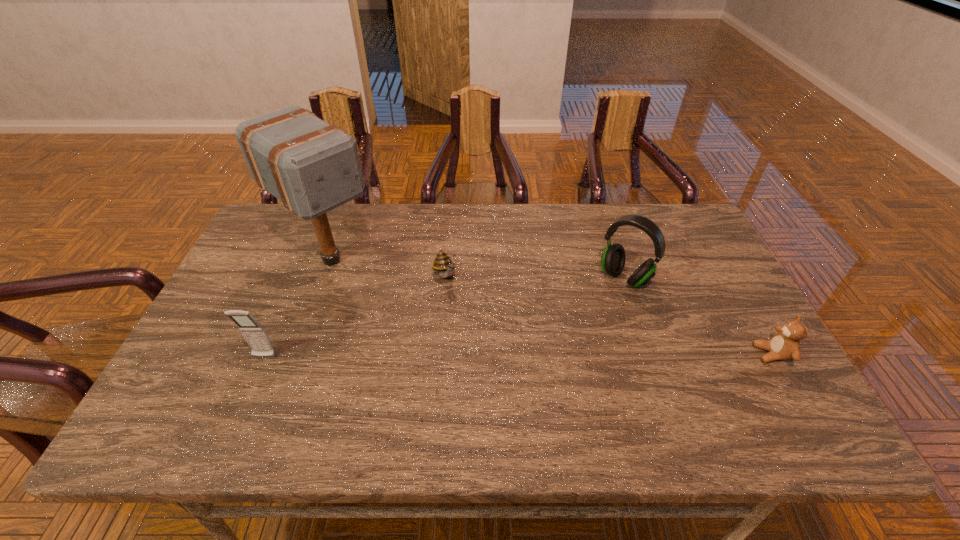
You are a GUI agent. You are given a task and a screenshot of the screen. Output one action in this format:
    pyautogui.click(x=<x>, y=<y>)
    Task: Click on the free space located on the striking surface of the tallest object
    Image resolution: width=960 pixels, height=540 pixels.
    Given the screenshot: What is the action you would take?
    pyautogui.click(x=413, y=328)

At what (x,y) coordinates should I click in order to perform the action: click on free region located on the striking surface of the tallest object. Please return your answer as a coordinate pair (x, y). Looking at the image, I should click on pyautogui.click(x=453, y=361).

At what (x,y) coordinates should I click in order to perform the action: click on blank area located on the ear cups of the fourth object from left to right. Please return your answer as a coordinate pair (x, y). The height and width of the screenshot is (540, 960). Looking at the image, I should click on (549, 365).

Where is `vacant space located on the ear cups of the fourth object from left to right`? The image size is (960, 540). vacant space located on the ear cups of the fourth object from left to right is located at coordinates (549, 365).

What are the coordinates of `vacant space located on the ear cups of the fourth object from left to right` in the screenshot? It's located at (545, 370).

Locate an element on the screen. blank area located 0.050m on the face of the snail is located at coordinates (456, 301).

You are a GUI agent. You are given a task and a screenshot of the screen. Output one action in this format:
    pyautogui.click(x=<x>, y=<y>)
    Task: Click on the free space located on the face of the snail
    Image resolution: width=960 pixels, height=540 pixels.
    Given the screenshot: What is the action you would take?
    pyautogui.click(x=493, y=364)

Locate an element on the screen. This screenshot has height=540, width=960. blank space located 0.140m on the face of the snail is located at coordinates (469, 323).

The width and height of the screenshot is (960, 540). In order to click on object situated at the far edge in this screenshot , I will do `click(311, 166)`.

I want to click on object present at the near edge, so click(x=785, y=345).